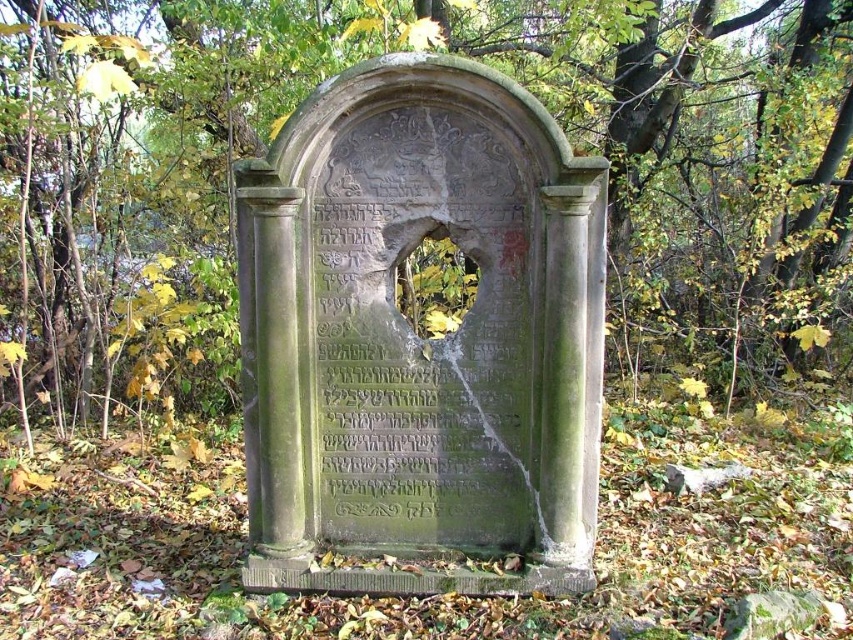
Question: Is green stone tombstone at center bigger than green stone monument at center?

Choices:
 (A) no
 (B) yes

Answer: (B)

Question: Among these points, which one is nearest to the camera?

Choices:
 (A) tap(813, 205)
 (B) tap(392, 202)

Answer: (B)

Question: Which point is closer to the camera?

Choices:
 (A) green stone monument at center
 (B) green stone tombstone at center

Answer: (A)

Question: From the image, what is the correct spatial relationship of green stone tombstone at center in relation to green stone monument at center?

Choices:
 (A) right
 (B) left

Answer: (A)

Question: Can you confirm if green stone tombstone at center is thinner than green stone monument at center?

Choices:
 (A) yes
 (B) no

Answer: (B)

Question: Which point appears farthest from the camera in this image?

Choices:
 (A) (166, 308)
 (B) (480, 256)

Answer: (A)